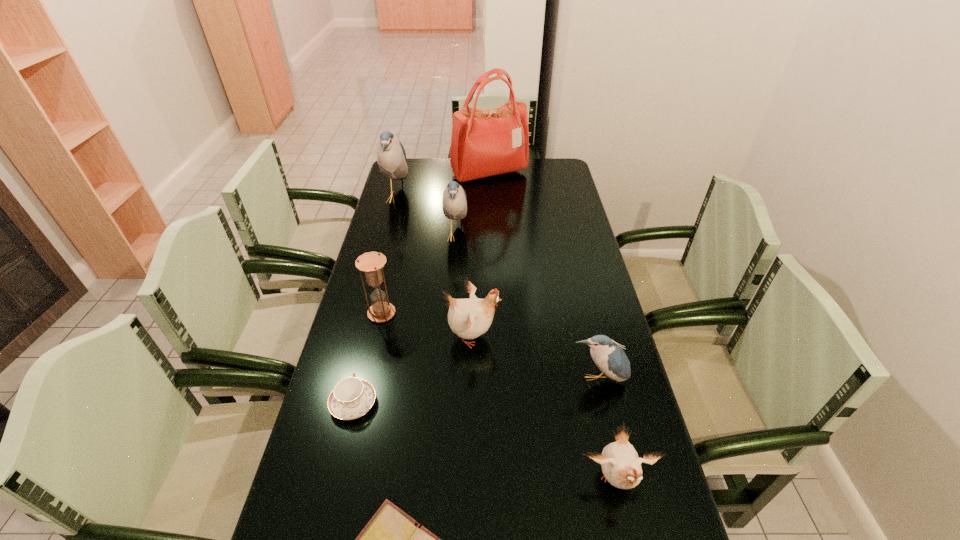
Where is `vacant area at the far edge`? This screenshot has width=960, height=540. vacant area at the far edge is located at coordinates (432, 168).

The width and height of the screenshot is (960, 540). In the image, there is a desktop. What are the coordinates of `vacant space at the left edge` in the screenshot? It's located at (400, 243).

The image size is (960, 540). In the image, there is a desktop. Find the location of `vacant space at the right edge`. vacant space at the right edge is located at coordinates (604, 377).

You are a GUI agent. You are given a task and a screenshot of the screen. Output one action in this format:
    pyautogui.click(x=<x>, y=<y>)
    Task: Click on the vacant space in between the tallest object and the nearer white bird
    Image resolution: width=960 pixels, height=540 pixels.
    Given the screenshot: What is the action you would take?
    pyautogui.click(x=553, y=327)

Identify the location of free space between the nearest blue bird and the red handbag. (543, 277).

Identify the location of vacant space in between the second blue bird from left to right and the nearer white bird. This screenshot has width=960, height=540. (537, 358).

The image size is (960, 540). I want to click on vacant area between the hourglass and the seventh tallest object, so click(499, 397).

You are a GUI agent. You are given a task and a screenshot of the screen. Output one action in this format:
    pyautogui.click(x=<x>, y=<y>)
    Task: Click on the vacant area between the eighth tallest object and the tallest object
    
    Given the screenshot: What is the action you would take?
    pyautogui.click(x=421, y=288)

Identify the location of empty space between the farther white bird and the second tallest object. The height and width of the screenshot is (540, 960). (435, 267).

Locate an element on the screen. The width and height of the screenshot is (960, 540). vacant space in between the shortest bird and the rightmost blue bird is located at coordinates (607, 431).